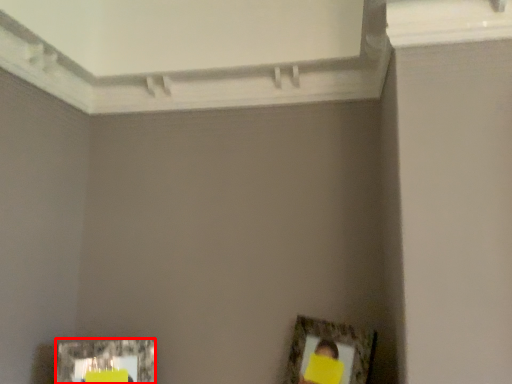
Question: From the image, what is the correct spatial relationship of picture frame (annotated by the red box) in relation to picture frame?

Choices:
 (A) left
 (B) right

Answer: (A)